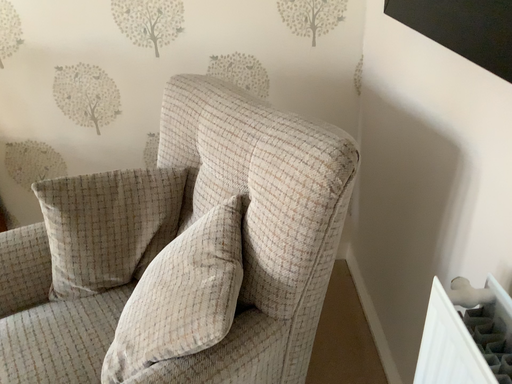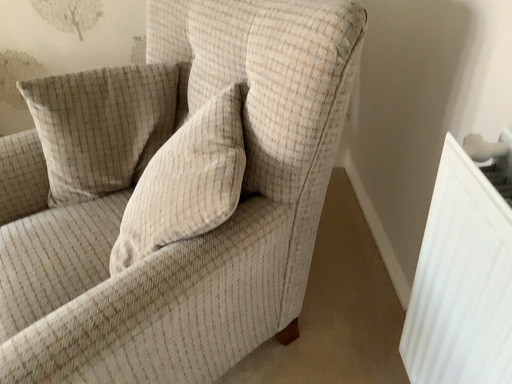
Question: Which way did the camera rotate in the video?

Choices:
 (A) rotated upward
 (B) rotated downward

Answer: (B)